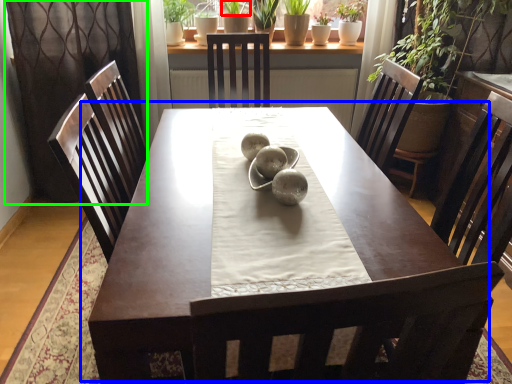
Question: Considering the real-world distances, which object is farthest from plant (highlighted by a red box)? table (highlighted by a blue box) or curtain (highlighted by a green box)?

Choices:
 (A) table
 (B) curtain

Answer: (A)